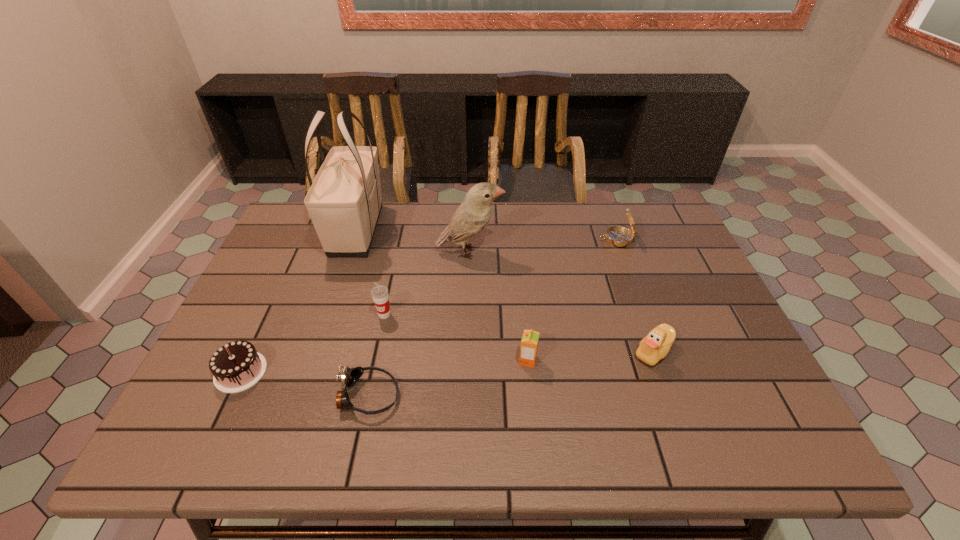
Find the location of a particular element. free space that satisfies the following two spatial constraints: 1. on the side of the third object from right to left with the logo; 2. on the right side of the fourth farthest object is located at coordinates (374, 361).